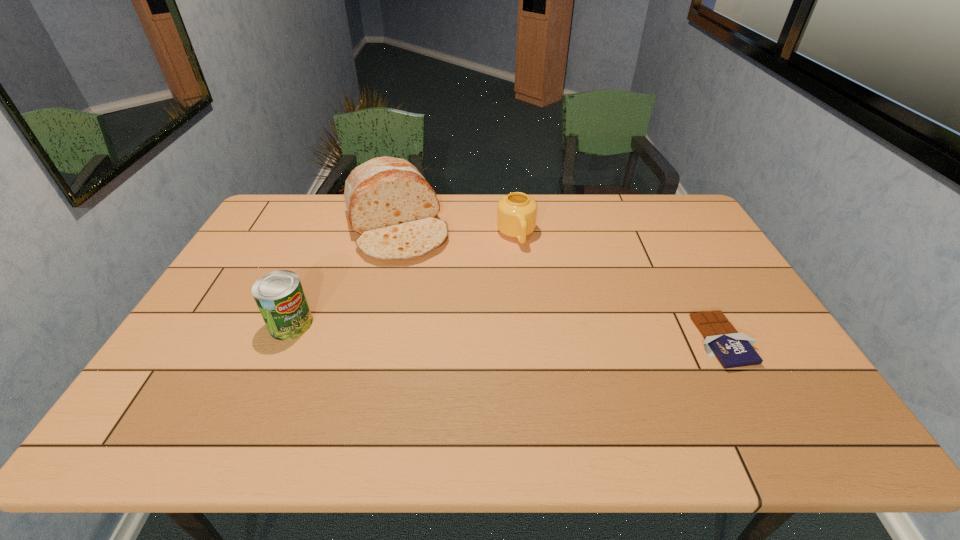
Locate an element on the screen. This screenshot has width=960, height=540. vacant space located 0.300m at the sliced end of the tallest object is located at coordinates (439, 329).

Locate an element on the screen. This screenshot has width=960, height=540. blank space located 0.070m at the sliced end of the tallest object is located at coordinates (416, 276).

The height and width of the screenshot is (540, 960). Find the location of `vacant space located at the sliced end of the tallest object`. vacant space located at the sliced end of the tallest object is located at coordinates (441, 331).

This screenshot has width=960, height=540. Find the location of `mug that is at the far edge`. mug that is at the far edge is located at coordinates (516, 212).

I want to click on bread at the far edge, so click(389, 203).

I want to click on object located in the near edge section of the desktop, so click(733, 349).

This screenshot has height=540, width=960. In order to click on object that is at the right edge in this screenshot , I will do `click(733, 349)`.

Image resolution: width=960 pixels, height=540 pixels. I want to click on object located in the near right corner section of the desktop, so click(x=733, y=349).

I want to click on free space at the far edge of the desktop, so click(x=339, y=199).

Locate an element on the screen. vacant space at the near edge of the desktop is located at coordinates (566, 391).